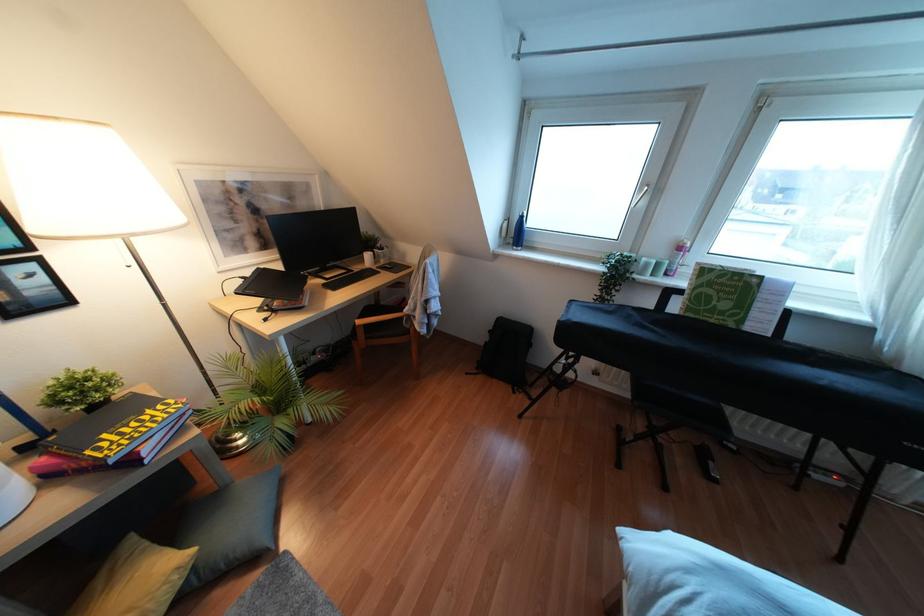
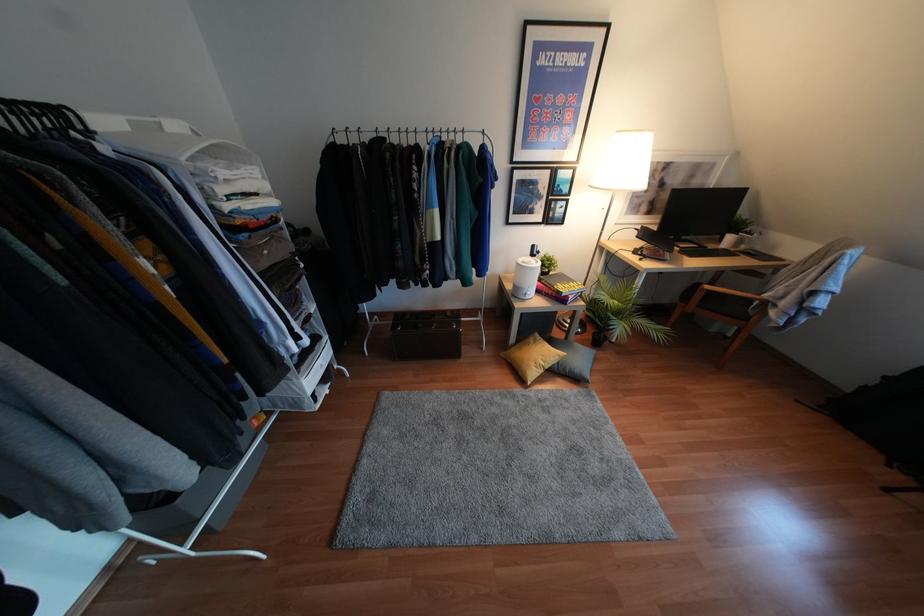
The point at (149,411) is marked in the first image. Where is the corresponding point in the second image?

(570, 283)